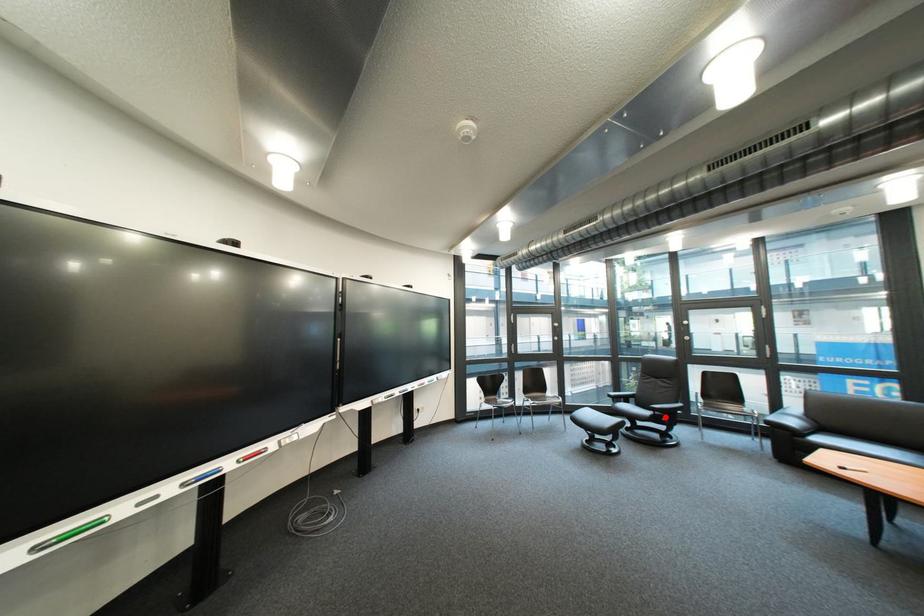
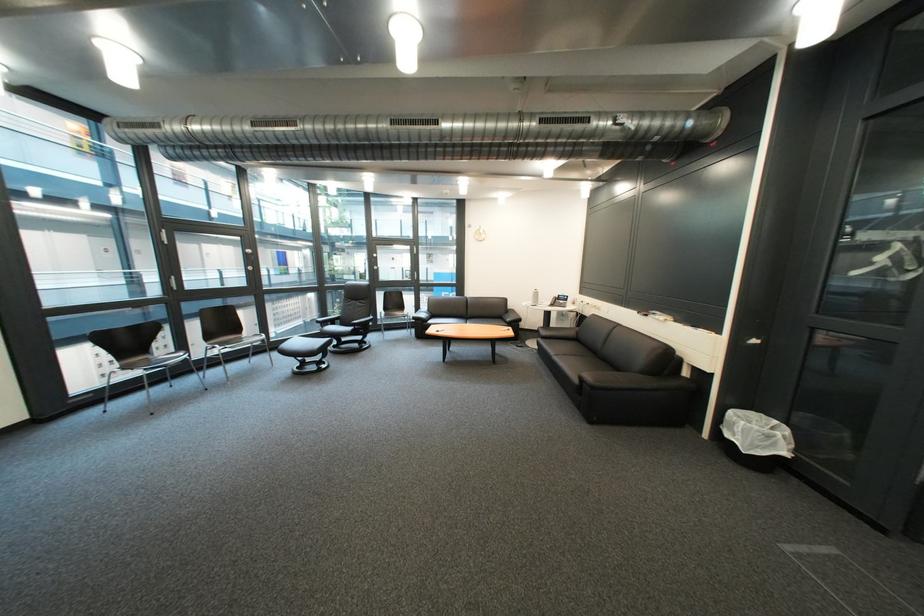
Locate, in the second image, the point that corresponds to the highlighted location in the first image.

(366, 331)